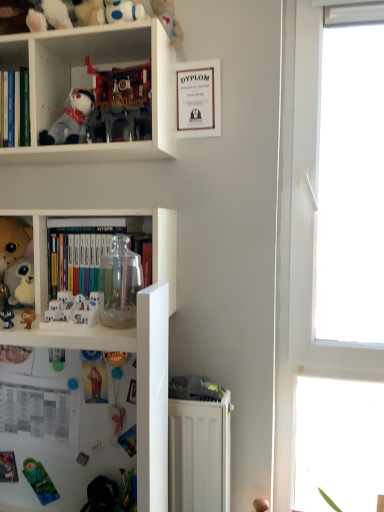
Question: Is translucent plastic toy at lower left, marked as the first toy in a bottom-to-top arrangement, smaller than white plastic bookcase at center, marked as the second bookcase in a top-to-bottom arrangement?

Choices:
 (A) yes
 (B) no

Answer: (A)

Question: Would you say white plastic bookcase at center, marked as the second bookcase in a top-to-bottom arrangement, is part of translucent plastic toy at lower left, marked as the first toy in a bottom-to-top arrangement,'s contents?

Choices:
 (A) no
 (B) yes

Answer: (A)

Question: Does translucent plastic toy at lower left, the 8th toy in the top-to-bottom sequence, come in front of white plastic bookcase at center, marked as the second bookcase in a top-to-bottom arrangement?

Choices:
 (A) no
 (B) yes

Answer: (A)

Question: Is translucent plastic toy at lower left, the 8th toy in the top-to-bottom sequence, placed right next to white plastic bookcase at center, marked as the second bookcase in a top-to-bottom arrangement?

Choices:
 (A) no
 (B) yes

Answer: (A)

Question: Is translucent plastic toy at lower left, marked as the first toy in a bottom-to-top arrangement, further to the viewer compared to white plastic bookcase at center, marked as the second bookcase in a top-to-bottom arrangement?

Choices:
 (A) no
 (B) yes

Answer: (B)

Question: Considering the positions of matte plastic monkey at lower left, which is the 6th toy from top to bottom, and transparent glass jar at center, acting as the first book starting from the bottom, in the image, is matte plastic monkey at lower left, which is the 6th toy from top to bottom, taller or shorter than transparent glass jar at center, acting as the first book starting from the bottom,?

Choices:
 (A) tall
 (B) short

Answer: (B)

Question: In the image, is matte plastic monkey at lower left, arranged as the third toy when ordered from the bottom, on the left side or the right side of transparent glass jar at center, placed as the 1th book when sorted from right to left?

Choices:
 (A) right
 (B) left

Answer: (B)

Question: In the image, is matte plastic monkey at lower left, arranged as the third toy when ordered from the bottom, positioned in front of or behind transparent glass jar at center, which is counted as the second book, starting from the left?

Choices:
 (A) front
 (B) behind

Answer: (A)

Question: Considering the positions of matte plastic monkey at lower left, arranged as the third toy when ordered from the bottom, and transparent glass jar at center, placed as the 1th book when sorted from right to left, in the image, is matte plastic monkey at lower left, arranged as the third toy when ordered from the bottom, bigger or smaller than transparent glass jar at center, placed as the 1th book when sorted from right to left,?

Choices:
 (A) small
 (B) big

Answer: (A)

Question: From a real-world perspective, is pink fabric toy at lower center, arranged as the second toy when ordered from the bottom, positioned above or below fluffy plush toy at left, which appears as the 6th toy when ordered from the bottom?

Choices:
 (A) below
 (B) above

Answer: (A)

Question: Is pink fabric toy at lower center, arranged as the second toy when ordered from the bottom, inside the boundaries of fluffy plush toy at left, which is the 3th toy from top to bottom, or outside?

Choices:
 (A) inside
 (B) outside

Answer: (B)

Question: Is pink fabric toy at lower center, arranged as the second toy when ordered from the bottom, taller or shorter than fluffy plush toy at left, which is the 3th toy from top to bottom?

Choices:
 (A) tall
 (B) short

Answer: (B)

Question: Does point (117, 414) appear closer or farther from the camera than point (8, 222)?

Choices:
 (A) closer
 (B) farther

Answer: (A)

Question: Is point (64, 259) positioned closer to the camera than point (71, 93)?

Choices:
 (A) closer
 (B) farther

Answer: (A)

Question: Is transparent glass jar at center, arranged as the 2th book when viewed from the top, inside or outside of white plush toy at upper left, arranged as the second toy when viewed from the top?

Choices:
 (A) inside
 (B) outside

Answer: (B)